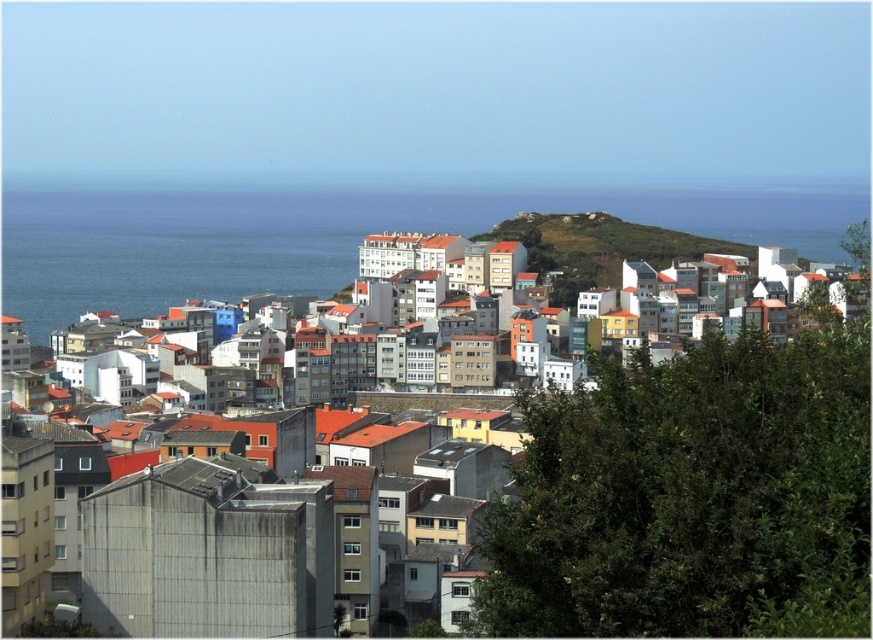
Based on the provided scene description, where is the white matte building at center located in terms of coordinates?

The white matte building at center is located at point coordinates of (693,497).

You are standing at the camera position and want to take a photo of the white matte building at center. If your camera has a maximum focus range of 120 meters, will it be able to focus on the building?

The white matte building at center is 127.93 meters away from the camera. Since the camera can only focus up to 120 meters, it will not be able to focus on the building.

You are standing at the point labeled as point (693, 497) in the image. Which building would you be facing? Please choose from the objects listed in the scene description.

The point (693, 497) corresponds to the white matte building at center, so you would be facing the white matte building at center.